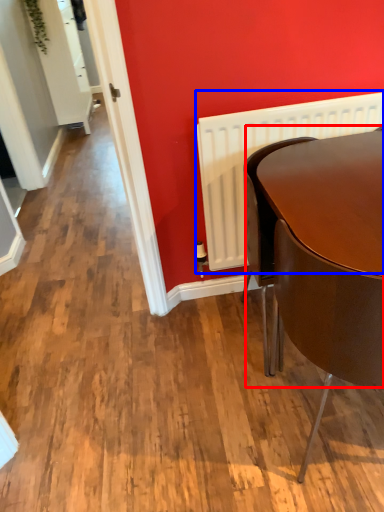
Question: Among these objects, which one is nearest to the camera, round table (highlighted by a red box) or radiator (highlighted by a blue box)?

Choices:
 (A) round table
 (B) radiator

Answer: (A)